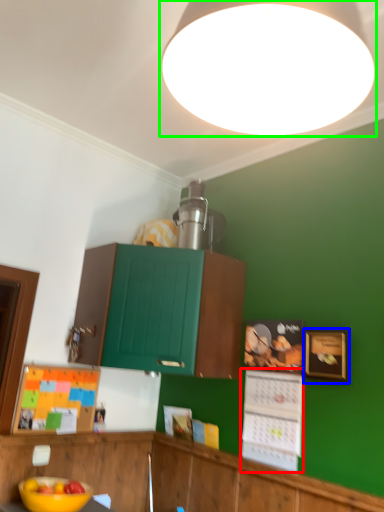
Question: Considering the real-world distances, which object is closest to bulletin board (highlighted by a red box)? picture frame (highlighted by a blue box) or lamp (highlighted by a green box).

Choices:
 (A) picture frame
 (B) lamp

Answer: (A)